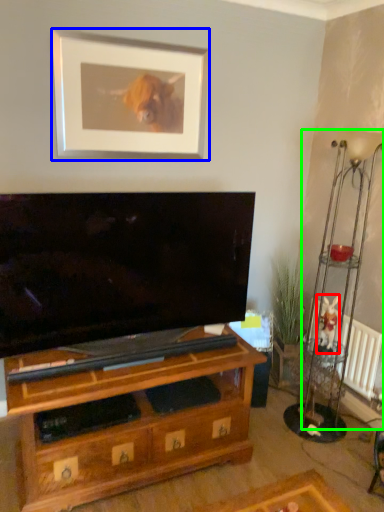
Question: Which is nearer to the animal (highlighted by a red box)? picture frame (highlighted by a blue box) or lamp (highlighted by a green box).

Choices:
 (A) picture frame
 (B) lamp

Answer: (B)